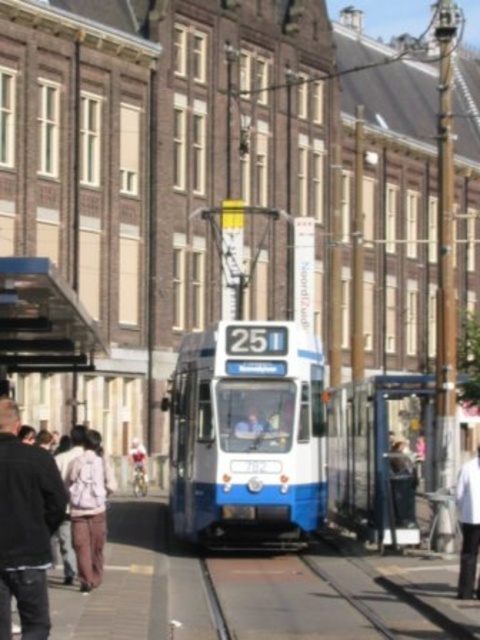
Question: Which object appears closest to the camera in this image?

Choices:
 (A) white cotton shirt at center
 (B) light pink fabric pants at lower left

Answer: (A)

Question: Which object is positioned closest to the light pink fabric pants at lower left?

Choices:
 (A) blue plastic bus stop at center
 (B) brown metal train track at center
 (C) white cotton shirt at center

Answer: (B)

Question: Estimate the real-world distances between objects in this image. Which object is closer to the light pink fabric pants at lower left?

Choices:
 (A) blue plastic bus stop at center
 (B) brown metal train track at center

Answer: (B)

Question: Does brown metal train track at center appear over white cotton shirt at center?

Choices:
 (A) no
 (B) yes

Answer: (A)

Question: Does brown metal train track at center appear over white cotton shirt at center?

Choices:
 (A) yes
 (B) no

Answer: (B)

Question: Is the position of brown metal train track at center less distant than that of light pink fabric pants at lower left?

Choices:
 (A) yes
 (B) no

Answer: (A)